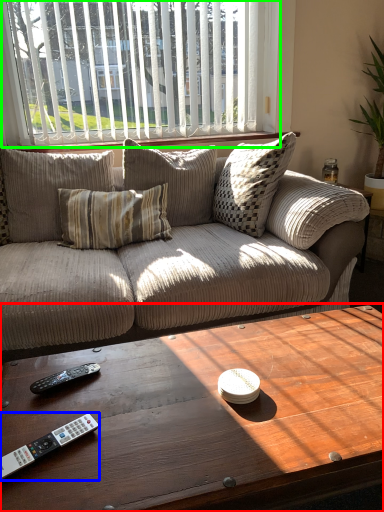
Question: Considering the real-world distances, which object is closest to coffee table (highlighted by a red box)? remote control (highlighted by a blue box) or window (highlighted by a green box).

Choices:
 (A) remote control
 (B) window

Answer: (A)